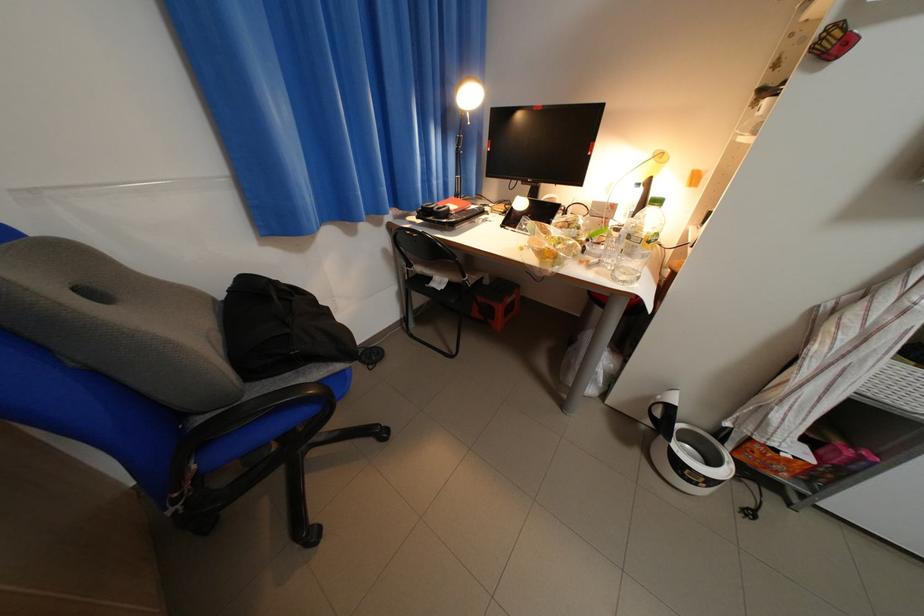
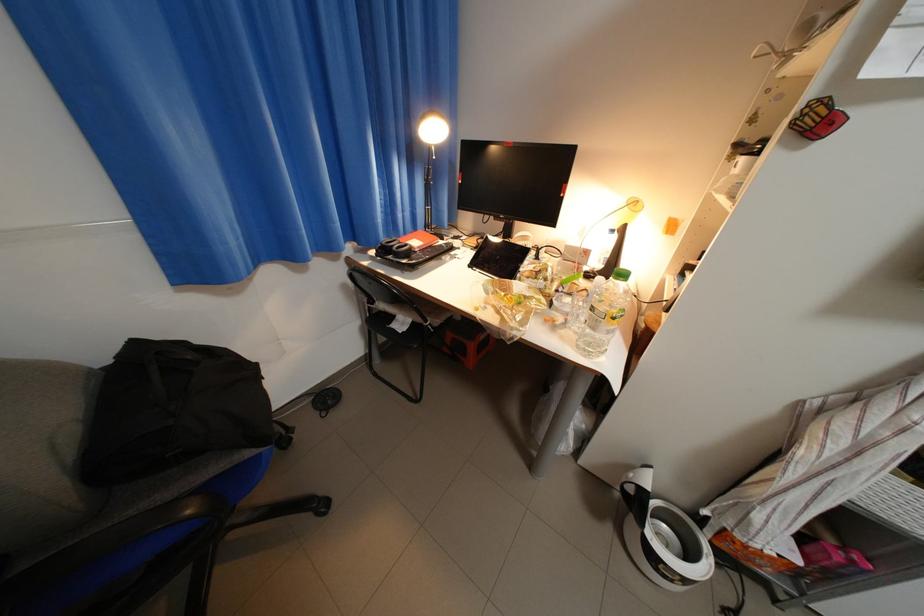
Find the pixel in the second image that matches point 436,215 in the first image.

(395, 253)